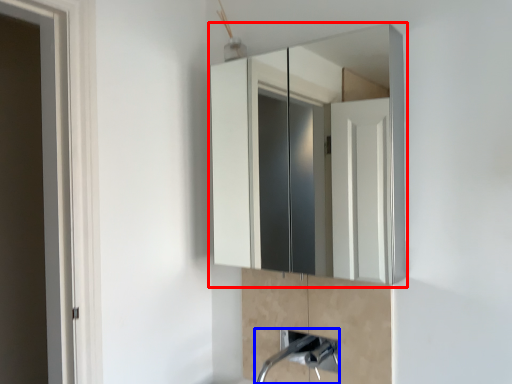
Question: Which object appears closest to the camera in this image, medicine cabinet (highlighted by a red box) or plumbing fixture (highlighted by a blue box)?

Choices:
 (A) medicine cabinet
 (B) plumbing fixture

Answer: (A)